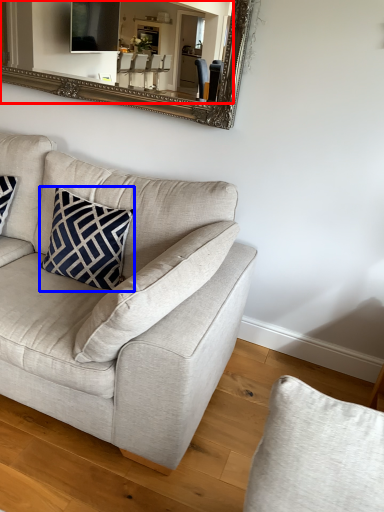
Question: Which of the following is the closest to the observer, mirror (highlighted by a red box) or pillow (highlighted by a blue box)?

Choices:
 (A) mirror
 (B) pillow

Answer: (B)